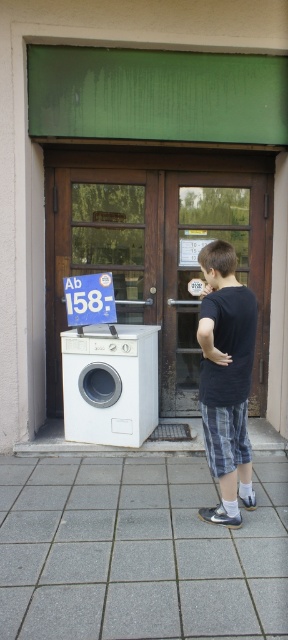
In the scene shown: You are standing in front of the building and want to take a photo of the white plastic washing machine at lower left. If your camera has a maximum focus range of 5 meters, will you be able to capture the washing machine clearly?

The white plastic washing machine at lower left and camera are 4.85 meters apart from each other. Since the distance is within the camera maximum focus range of 5 meters, the camera can capture the washing machine clearly.

You are a delivery person who just arrived at the building. You need to place a new dark blue cotton shirt at center on top of the white plastic washing machine at lower left. Can you do that?

The white plastic washing machine at lower left is positioned over dark blue cotton shirt at center, meaning the shirt is already underneath the washing machine. Therefore, you cannot place the shirt on top of the washing machine as it is already underneath.

You are a delivery person who just arrived at the building and need to place a dark blue cotton shirt at center onto the white glossy washing machine at left. Given that the shirt is 3.85 feet away from the washing machine, can you safely carry it without needing to move the washing machine?

The dark blue cotton shirt at center is 3.85 feet away from the white glossy washing machine at left. Since the distance is manageable for carrying, you can safely place the shirt onto the washing machine without needing to move it.